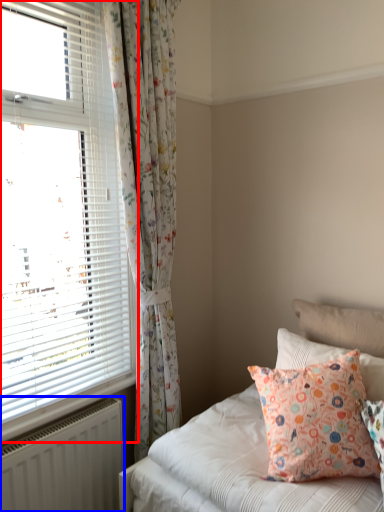
Question: Which point is further to the camera, window (highlighted by a red box) or radiator (highlighted by a blue box)?

Choices:
 (A) window
 (B) radiator

Answer: (B)